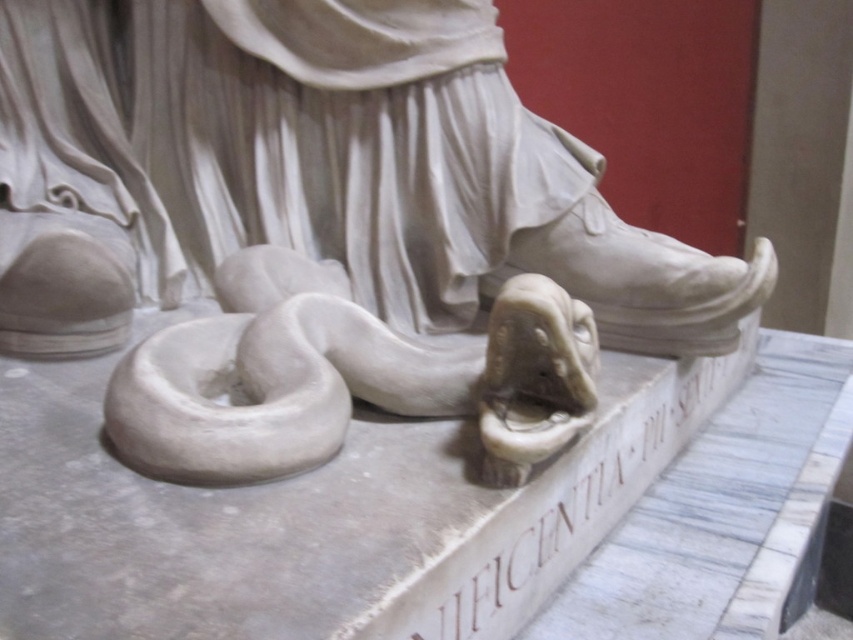
Can you confirm if white marble snake at lower center is positioned below white matte bagel at lower left?

No.

Which is more to the right, white marble snake at lower center or white matte bagel at lower left?

From the viewer's perspective, white marble snake at lower center appears more on the right side.

You are a GUI agent. You are given a task and a screenshot of the screen. Output one action in this format:
    pyautogui.click(x=<x>, y=<y>)
    Task: Click on the white marble snake at lower center
    
    Given the screenshot: What is the action you would take?
    pyautogui.click(x=444, y=369)

The height and width of the screenshot is (640, 853). Identify the location of white marble snake at lower center. (444, 369).

Measure the distance between point (457, 298) and camera.

They are 6.35 feet apart.

Who is shorter, white marble snake at lower left or white marble snake at lower center?

white marble snake at lower center is shorter.

Does point (364, 244) lie behind point (527, 324)?

Yes, point (364, 244) is farther from viewer.

The image size is (853, 640). I want to click on white marble snake at lower left, so click(338, 160).

Can you confirm if white marble snake at lower left is bigger than white matte bagel at lower left?

Correct, white marble snake at lower left is larger in size than white matte bagel at lower left.

Is white marble snake at lower left closer to the viewer compared to white matte bagel at lower left?

No, white marble snake at lower left is further to the viewer.

Which is behind, point (602, 202) or point (202, 392)?

Point (602, 202)

Find the location of a particular element. This screenshot has width=853, height=640. white marble snake at lower left is located at coordinates (338, 160).